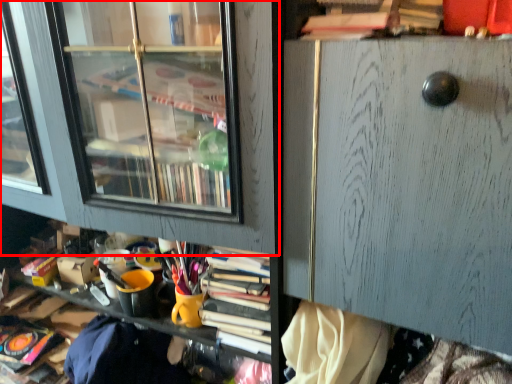
Question: From the image's perspective, where is shelf (annotated by the red box) located relative to file cabinet?

Choices:
 (A) above
 (B) below

Answer: (B)